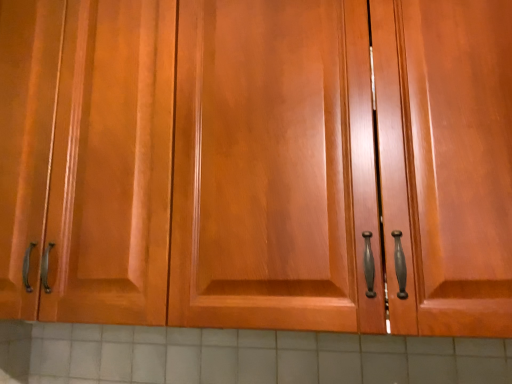
Measure the distance between white tile at lower center and camera.

35.61 inches.

Image resolution: width=512 pixels, height=384 pixels. What do you see at coordinates (240, 356) in the screenshot? I see `white tile at lower center` at bounding box center [240, 356].

This screenshot has width=512, height=384. What are the coordinates of `white tile at lower center` in the screenshot? It's located at (240, 356).

This screenshot has width=512, height=384. Find the location of `white tile at lower center`. white tile at lower center is located at coordinates (240, 356).